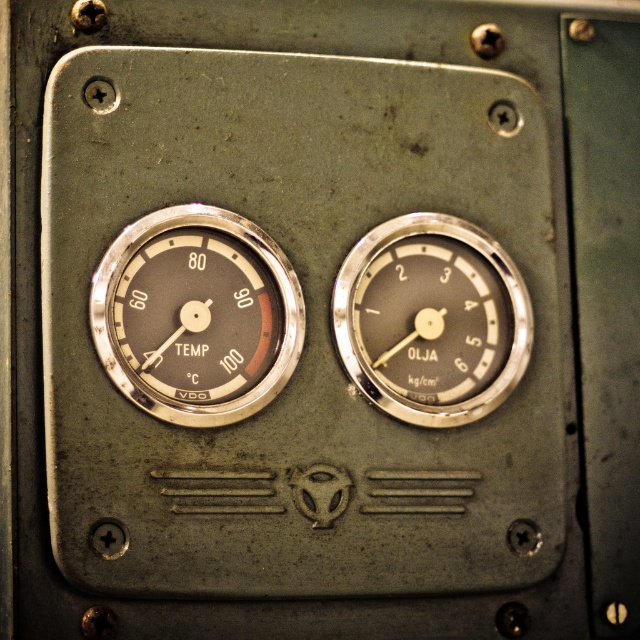
Question: Which of the following is the closest to the observer?

Choices:
 (A) metallic silver gauge at center
 (B) matte silver gauge at upper left

Answer: (B)

Question: Where is matte silver gauge at upper left located in relation to metallic silver gauge at center in the image?

Choices:
 (A) below
 (B) above

Answer: (B)

Question: Which object is farther from the camera taking this photo?

Choices:
 (A) metallic silver gauge at center
 (B) matte silver gauge at upper left

Answer: (A)

Question: Is matte silver gauge at upper left thinner than metallic silver gauge at center?

Choices:
 (A) yes
 (B) no

Answer: (A)

Question: Is matte silver gauge at upper left further to the viewer compared to metallic silver gauge at center?

Choices:
 (A) yes
 (B) no

Answer: (B)

Question: Which point is closer to the camera taking this photo?

Choices:
 (A) (516, 358)
 (B) (196, 330)

Answer: (B)